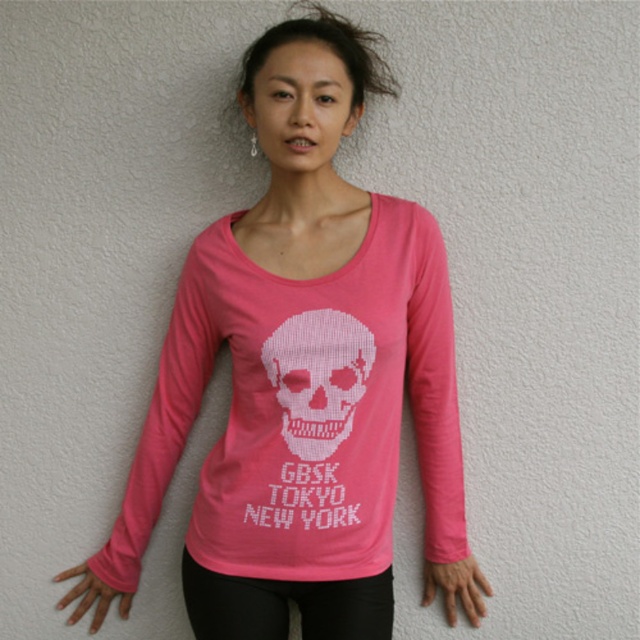
Which is behind, point (221, 467) or point (472, 557)?

Point (472, 557)

Can you confirm if matte pink t-shirt at center is positioned to the right of matte pink hand at lower center?

Incorrect, matte pink t-shirt at center is not on the right side of matte pink hand at lower center.

Image resolution: width=640 pixels, height=640 pixels. Describe the element at coordinates (330, 348) in the screenshot. I see `matte pink t-shirt at center` at that location.

Locate an element on the screen. This screenshot has height=640, width=640. matte pink t-shirt at center is located at coordinates (330, 348).

Is matte pink t-shirt at center below pink matte hand at lower left?

Actually, matte pink t-shirt at center is above pink matte hand at lower left.

Which of these two, matte pink t-shirt at center or pink matte hand at lower left, stands taller?

matte pink t-shirt at center

Who is more distant from viewer, (392, 291) or (88, 576)?

The point (88, 576) is more distant.

The image size is (640, 640). I want to click on matte pink t-shirt at center, so click(x=330, y=348).

Which is more to the right, black matte leggings at lower center or pink matte hand at lower left?

black matte leggings at lower center is more to the right.

Looking at this image, who is positioned more to the left, black matte leggings at lower center or pink matte hand at lower left?

pink matte hand at lower left is more to the left.

Is point (237, 628) positioned behind point (68, 592)?

No, it is in front of (68, 592).

You are a GUI agent. You are given a task and a screenshot of the screen. Output one action in this format:
    pyautogui.click(x=<x>, y=<y>)
    Task: Click on the black matte leggings at lower center
    The image size is (640, 640).
    Given the screenshot: What is the action you would take?
    pyautogui.click(x=285, y=605)